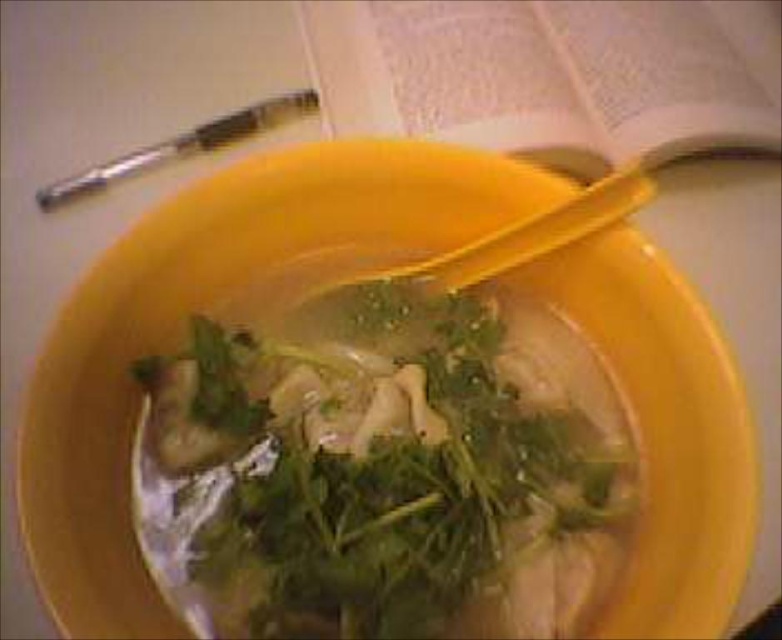
You are a food critic analyzing the presentation of the dish in the image. The bowl contains a soup with green leafy vegetables and a metallic pen nearby. Which object, the green leafy vegetable at center or the metallic pen at upper left, has a greater width?

The green leafy vegetable at center has a greater width than the metallic pen at upper left according to the description.

You are a student who needs to take notes about the soup in the yellow bowl. The white paper book at upper center and the metallic pen at upper left are on the table. Which object should you reach for first to start writing?

You should reach for the metallic pen at upper left first because it is located below the white paper book at upper center, making it closer to your hand if you are sitting at the table.

You are a chef preparing a dish and see the green leafy vegetable at center and the white paper book at upper center in the image. Which object is closer to you?

The green leafy vegetable at center is positioned under the white paper book at upper center, meaning the white paper book at upper center is closer to you.